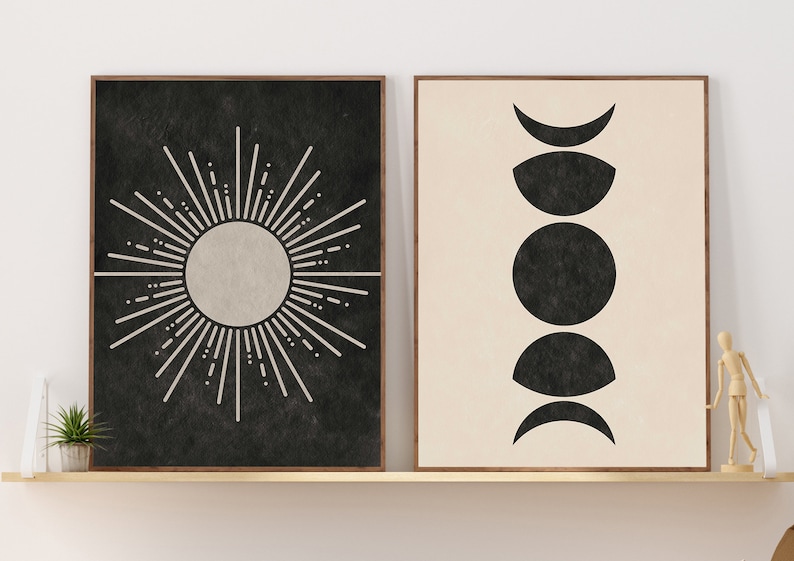
Where is `plant`? The width and height of the screenshot is (794, 561). plant is located at coordinates (75, 425).